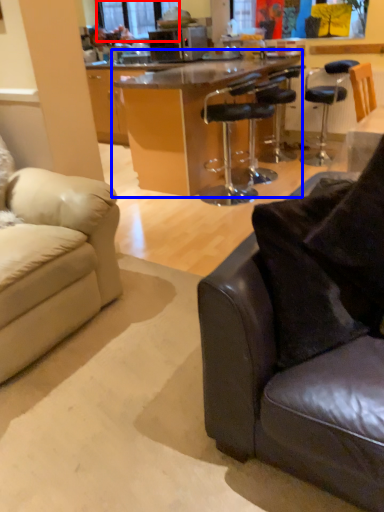
Question: Which of the following is the farthest to the observer, window screen (highlighted by a red box) or table (highlighted by a blue box)?

Choices:
 (A) window screen
 (B) table

Answer: (A)